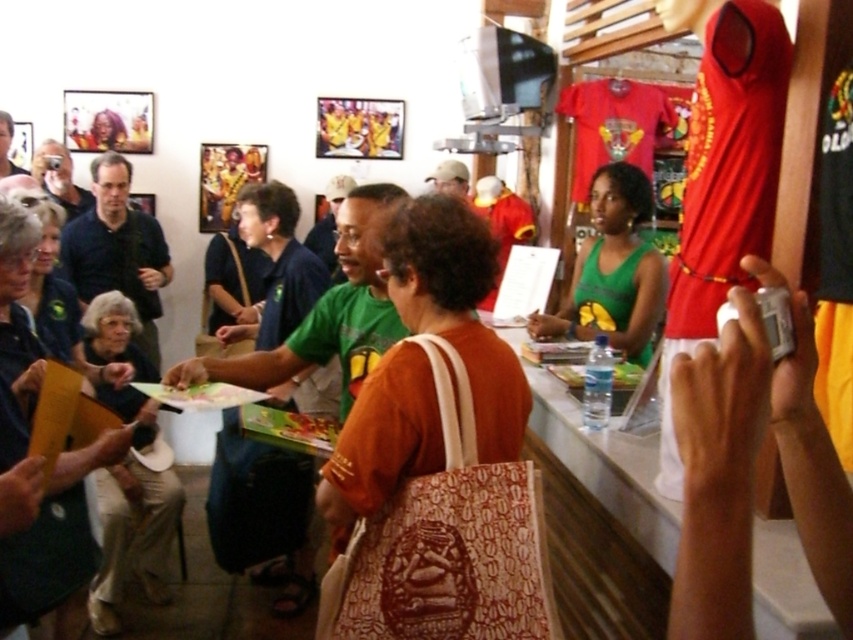
Question: Can you confirm if green fabric purse at left is positioned to the right of gray fabric purse at lower left?

Choices:
 (A) yes
 (B) no

Answer: (A)

Question: Based on their relative distances, which object is nearer to the green fabric purse at left?

Choices:
 (A) matte black laptop at upper left
 (B) gray fabric purse at lower left
 (C) green fabric shirt at left
 (D) brown fabric bag at center

Answer: (C)

Question: Which point is closer to the camera taking this photo?

Choices:
 (A) (79, 364)
 (B) (67, 173)
 (C) (131, 412)
 (D) (3, 144)

Answer: (A)

Question: Is green fabric purse at left in front of gray fabric purse at lower left?

Choices:
 (A) yes
 (B) no

Answer: (A)

Question: Does brown fabric bag at center appear on the left side of matte black camera at upper left?

Choices:
 (A) yes
 (B) no

Answer: (B)

Question: Which point is farther from the camera taking this photo?

Choices:
 (A) (445, 198)
 (B) (0, 141)

Answer: (B)